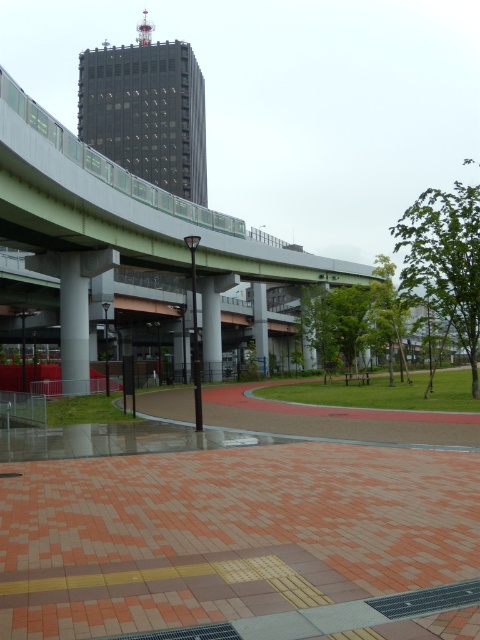
Question: From the image, what is the correct spatial relationship of red rubber path at center in relation to satin silver pole at center?

Choices:
 (A) below
 (B) above

Answer: (A)

Question: Which of the following is the farthest from the observer?

Choices:
 (A) satin silver pole at center
 (B) green concrete overpass at upper center

Answer: (A)

Question: Which of these objects is positioned farthest from the gray concrete pillar at center?

Choices:
 (A) red rubber path at center
 (B) green concrete overpass at upper center
 (C) satin silver pole at center

Answer: (C)

Question: In this image, where is green concrete overpass at upper center located relative to satin silver pole at center?

Choices:
 (A) right
 (B) left

Answer: (B)

Question: Which point is closer to the camera?

Choices:
 (A) green concrete overpass at upper center
 (B) brick paving at lower center
 (C) white concrete pillar at center
 (D) gray concrete pillar at center

Answer: (B)

Question: Is green concrete overpass at upper center wider than white concrete pillar at center?

Choices:
 (A) yes
 (B) no

Answer: (A)